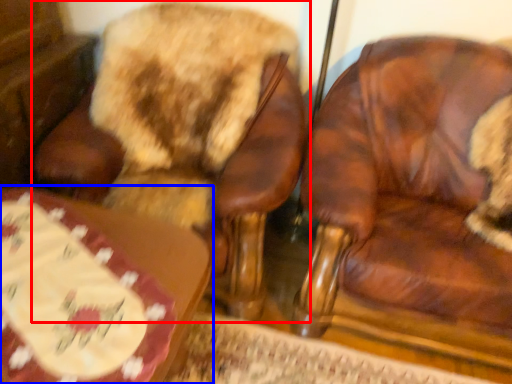
Question: Which object is closer to the camera taking this photo, chair (highlighted by a red box) or table (highlighted by a blue box)?

Choices:
 (A) chair
 (B) table

Answer: (B)